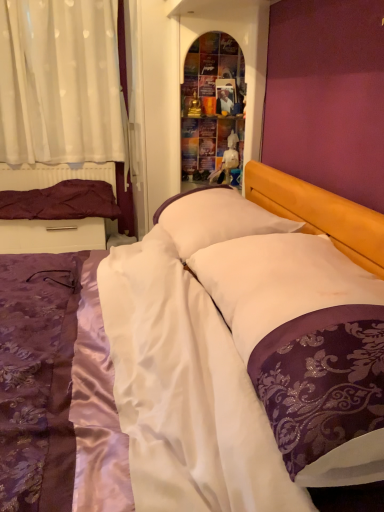
Question: Is purple satin bed at center positioned before purple satin pillow at left, which is counted as the 3th pillow, starting from the front?

Choices:
 (A) no
 (B) yes

Answer: (B)

Question: Does purple satin bed at center have a lesser height compared to purple satin pillow at left, which appears as the third pillow when viewed from the right?

Choices:
 (A) yes
 (B) no

Answer: (B)

Question: Can you confirm if purple satin bed at center is smaller than purple satin pillow at left, which is the 1th pillow in left-to-right order?

Choices:
 (A) yes
 (B) no

Answer: (B)

Question: Does purple satin bed at center appear on the right side of purple satin pillow at left, positioned as the 1th pillow in back-to-front order?

Choices:
 (A) no
 (B) yes

Answer: (B)

Question: Could purple satin pillow at left, which is the 1th pillow in left-to-right order, be considered to be inside purple satin bed at center?

Choices:
 (A) yes
 (B) no

Answer: (B)

Question: Considering the relative sizes of purple satin bed at center and purple satin pillow at left, which is the 1th pillow in left-to-right order, in the image provided, is purple satin bed at center bigger than purple satin pillow at left, which is the 1th pillow in left-to-right order,?

Choices:
 (A) yes
 (B) no

Answer: (A)

Question: Can you confirm if white soft pillow at center, acting as the 2th pillow starting from the front, is wider than white sheer curtain at upper left?

Choices:
 (A) yes
 (B) no

Answer: (A)

Question: Could you tell me if white soft pillow at center, acting as the 2th pillow starting from the front, is facing white sheer curtain at upper left?

Choices:
 (A) yes
 (B) no

Answer: (B)

Question: Is white soft pillow at center, acting as the 2th pillow starting from the front, taller than white sheer curtain at upper left?

Choices:
 (A) no
 (B) yes

Answer: (A)

Question: From a real-world perspective, is white soft pillow at center, positioned as the second pillow in left-to-right order, physically below white sheer curtain at upper left?

Choices:
 (A) yes
 (B) no

Answer: (A)

Question: Is white sheer curtain at upper left completely or partially inside white soft pillow at center, arranged as the 2th pillow when viewed from the right?

Choices:
 (A) no
 (B) yes

Answer: (A)

Question: Is white soft pillow at center, positioned as the second pillow in left-to-right order, positioned far away from white sheer curtain at upper left?

Choices:
 (A) yes
 (B) no

Answer: (A)

Question: Can you confirm if white satin pillow at center, the first pillow from the front, is taller than multicolored glass shelf at center?

Choices:
 (A) yes
 (B) no

Answer: (B)